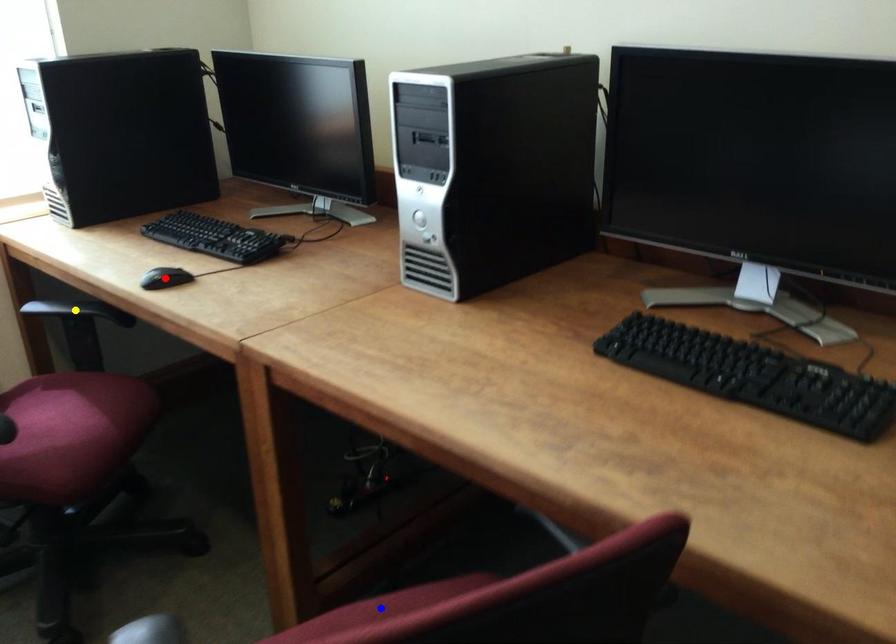
Order these from nearest to farthest:
A) blue point
B) red point
C) yellow point

1. blue point
2. red point
3. yellow point